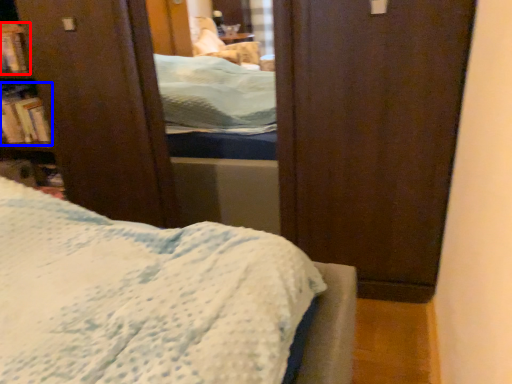
Question: Which object appears farthest to the camera in this image, book (highlighted by a red box) or book (highlighted by a blue box)?

Choices:
 (A) book
 (B) book

Answer: (B)